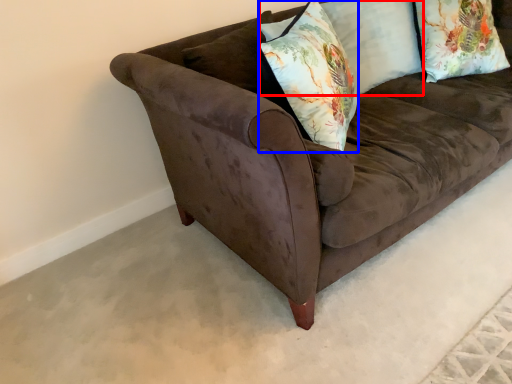
Question: Among these objects, which one is farthest to the camera, pillow (highlighted by a red box) or throw pillow (highlighted by a blue box)?

Choices:
 (A) pillow
 (B) throw pillow

Answer: (A)